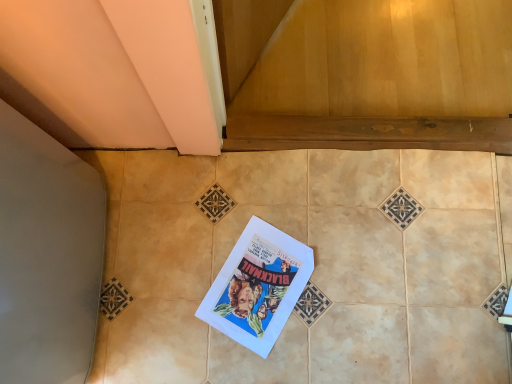
Where is `vacant area that is in front of white paper comic book at center`? vacant area that is in front of white paper comic book at center is located at coordinates (250, 359).